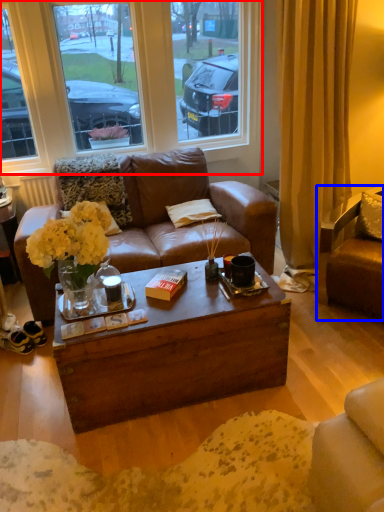
Question: Which object is closer to the camera taking this photo, window (highlighted by a red box) or chair (highlighted by a blue box)?

Choices:
 (A) window
 (B) chair

Answer: (B)